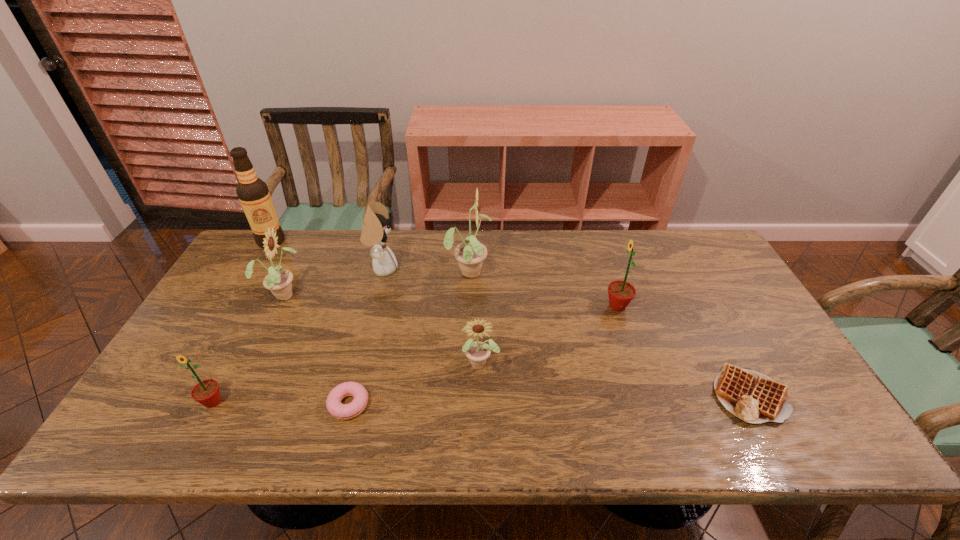
Image resolution: width=960 pixels, height=540 pixels. I want to click on the nearer green sunflower, so click(x=206, y=392).

Locate an element on the screen. the rightmost object is located at coordinates pos(753,397).

The width and height of the screenshot is (960, 540). I want to click on doughnut, so click(x=334, y=406).

Identify the location of blank space located on the label of the beige alcohol. The height and width of the screenshot is (540, 960). (218, 331).

At what (x,y) coordinates should I click in order to perform the action: click on vacant region located on the front-facing side of the tallest sunflower. Please return your answer as a coordinate pair (x, y). The width and height of the screenshot is (960, 540). Looking at the image, I should click on (610, 271).

Where is `vacant point located 0.250m at the front face of the black doll`? vacant point located 0.250m at the front face of the black doll is located at coordinates (476, 268).

Locate an element on the screen. The width and height of the screenshot is (960, 540). free space located on the front-facing side of the second smallest yellow sunflower is located at coordinates (323, 294).

Identify the location of free spot located on the face of the second object from right to left. Image resolution: width=960 pixels, height=540 pixels. (587, 306).

Locate an element on the screen. This screenshot has width=960, height=540. free location located on the face of the second object from right to left is located at coordinates (488, 306).

Locate an element on the screen. The width and height of the screenshot is (960, 540). vacant space located 0.220m on the face of the second object from right to left is located at coordinates click(x=529, y=306).